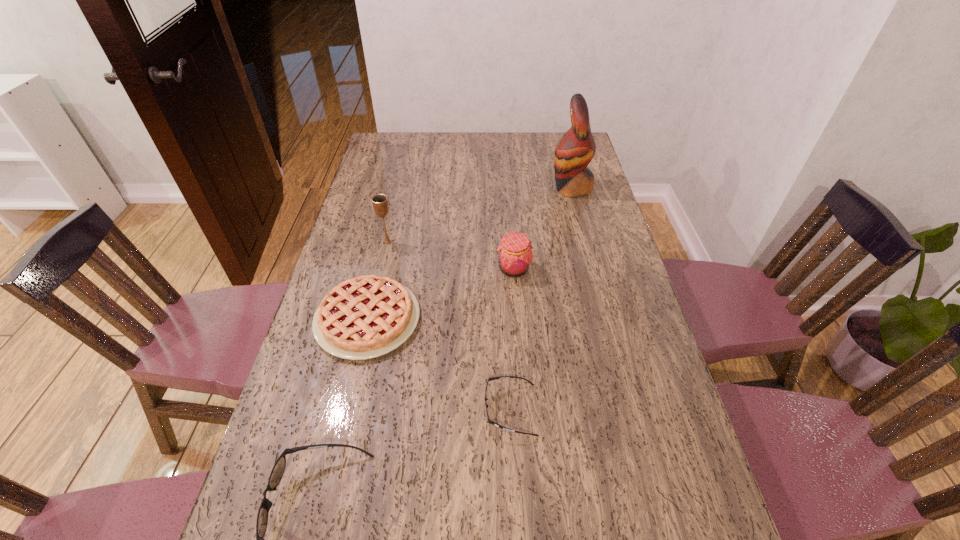
At what (x,y) coordinates should I click in order to perform the action: click on the right sunglasses. Please return your answer as a coordinate pair (x, y). Looking at the image, I should click on tap(488, 420).

The image size is (960, 540). Identify the location of the second nearest object. (488, 420).

At what (x,y) coordinates should I click in order to perform the action: click on jam. Please return your answer as a coordinate pair (x, y). The height and width of the screenshot is (540, 960). Looking at the image, I should click on (515, 255).

I want to click on the fourth nearest object, so click(515, 255).

Where is `the fifth shortest object`? the fifth shortest object is located at coordinates (380, 203).

Where is `chalice`? chalice is located at coordinates (380, 203).

Where is `the farthest object`? Image resolution: width=960 pixels, height=540 pixels. the farthest object is located at coordinates (574, 151).

Where is `the tallest object`? the tallest object is located at coordinates (574, 151).

I want to click on the fourth farthest object, so click(x=365, y=317).

The width and height of the screenshot is (960, 540). I want to click on vacant space situated on the front-facing side of the farther sunglasses, so click(411, 409).